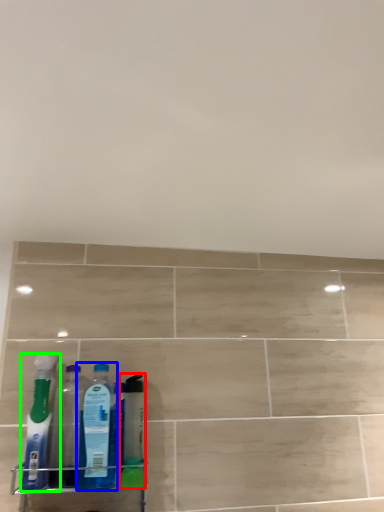
Question: Which is nearer to the cleaning product (highlighted by a red box)? bottle (highlighted by a blue box) or bottle (highlighted by a green box).

Choices:
 (A) bottle
 (B) bottle

Answer: (A)